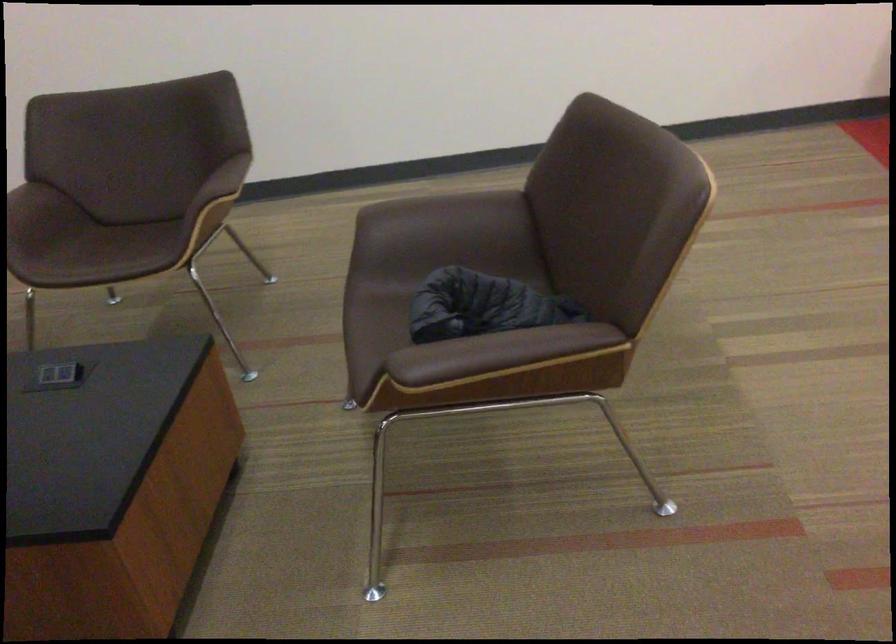
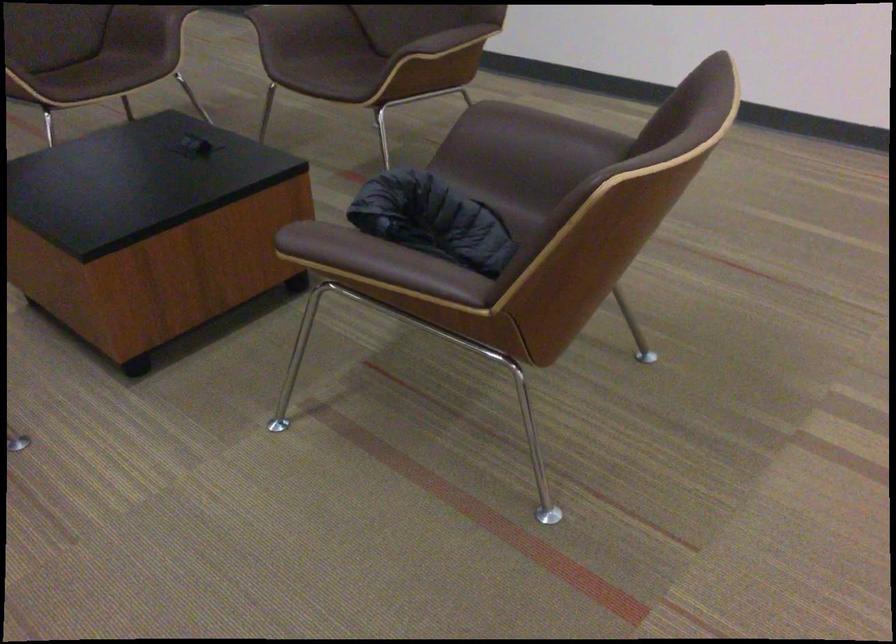
In the second image, find the point that corresponds to (x=475, y=346) in the first image.

(355, 250)